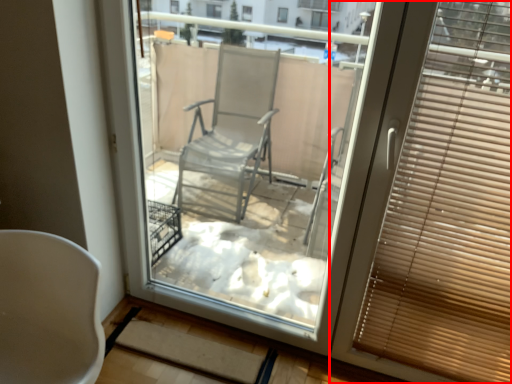
Question: From the image's perspective, considering the relative positions of window blind (annotated by the red box) and chair in the image provided, where is window blind (annotated by the red box) located with respect to the staircase?

Choices:
 (A) below
 (B) above

Answer: (B)